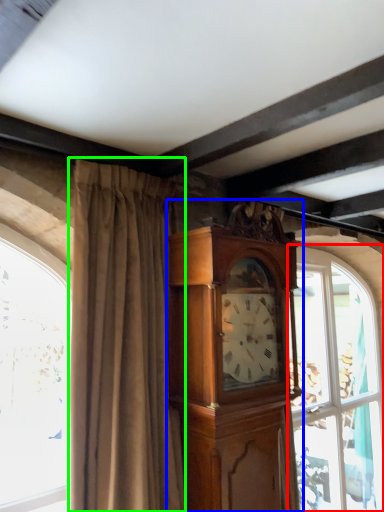
Question: Which object is positioned closest to window (highlighted by a red box)? Select from cabinetry (highlighted by a blue box) and curtain (highlighted by a green box).

Choices:
 (A) cabinetry
 (B) curtain

Answer: (A)